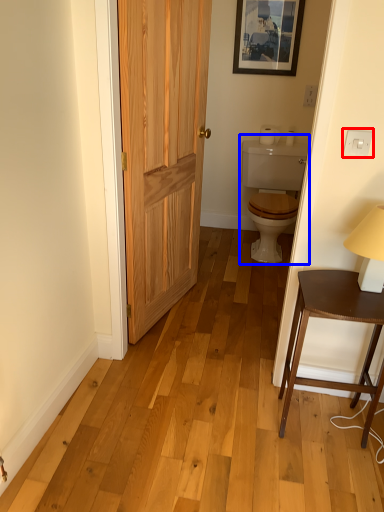
Question: Which point is closer to the camera, electric outlet (highlighted by a red box) or sink (highlighted by a blue box)?

Choices:
 (A) electric outlet
 (B) sink

Answer: (A)